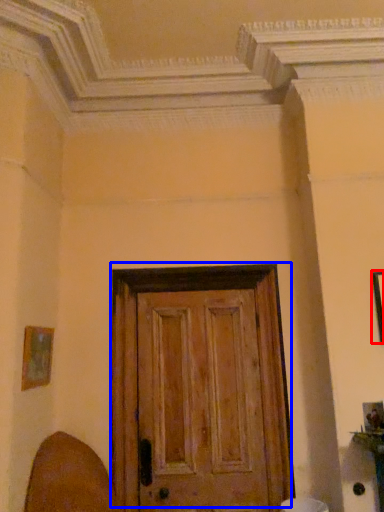
Question: Which point is further to the camera, picture frame (highlighted by a red box) or door (highlighted by a blue box)?

Choices:
 (A) picture frame
 (B) door

Answer: (B)